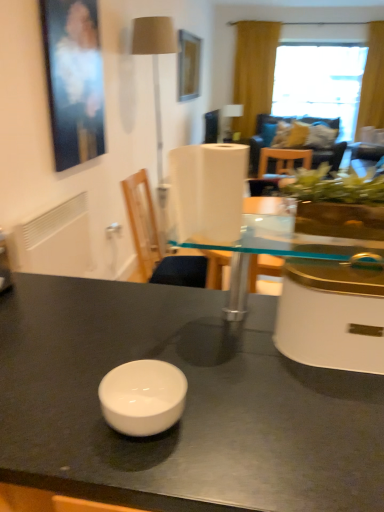
You are a GUI agent. You are given a task and a screenshot of the screen. Output one action in this format:
    pyautogui.click(x=<x>, y=<y>)
    Task: Click on the unoccupied space behind white glossy bowl at center
    Image resolution: width=384 pixels, height=512 pixels.
    Given the screenshot: What is the action you would take?
    pyautogui.click(x=167, y=351)